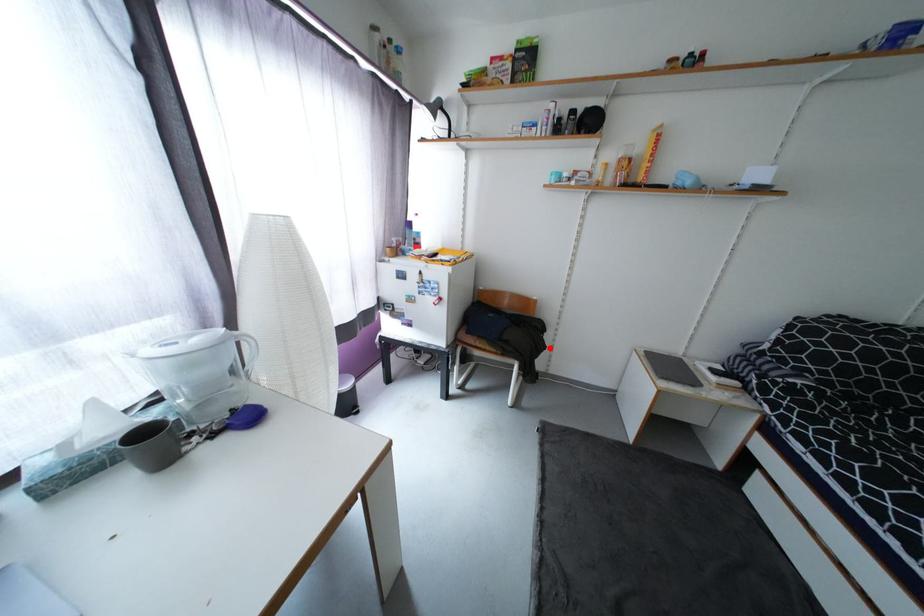
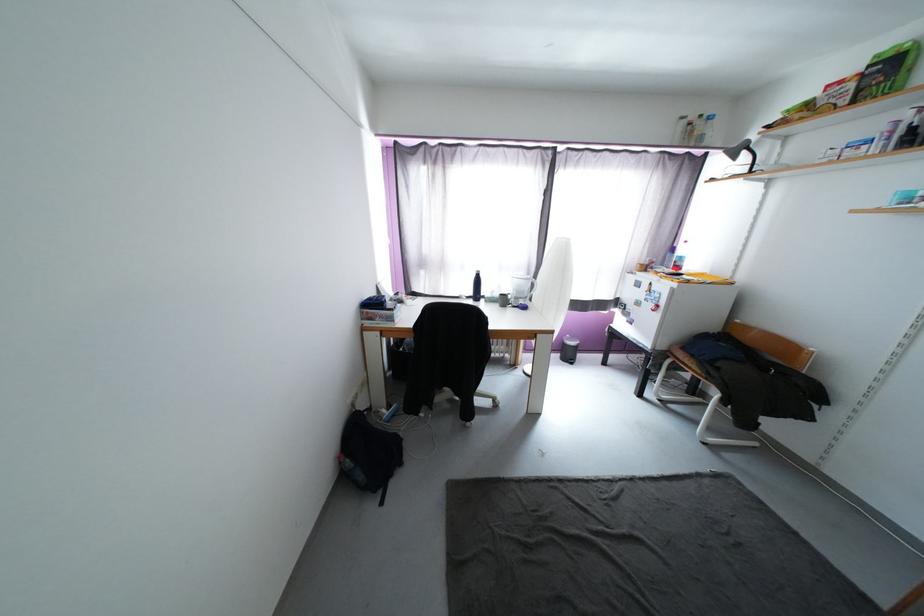
Where in the second image is the point corresponding to the highlighted location from the first image?

(812, 419)